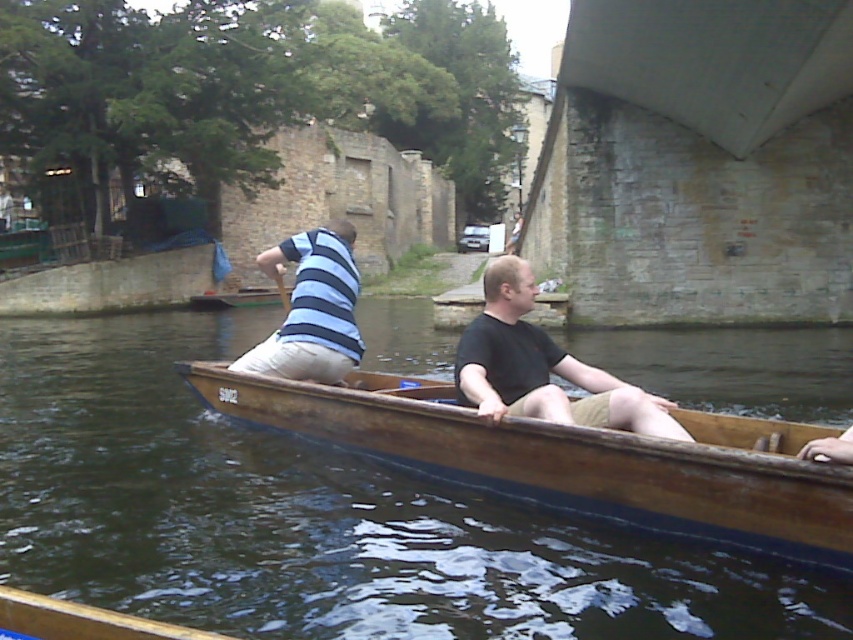
In the scene shown: You are standing on the dock and want to hand a life jacket to the person wearing the matte black shirt at center in the wooden punt. The wooden paddle at center is between you and them. Can you reach them without moving the paddle?

The matte black shirt at center is 4.97 meters away from the wooden paddle at center. Since the paddle is between you and the person, you would need to move it to reach them, as the distance is significant and likely out of arm reach.

You are a photographer trying to capture the matte black shirt at center in the wooden punt. According to the coordinates provided, where should you aim your camera to ensure the shirt is in the frame?

The matte black shirt at center is located at point (543, 368), so aim your camera at those coordinates to capture it.